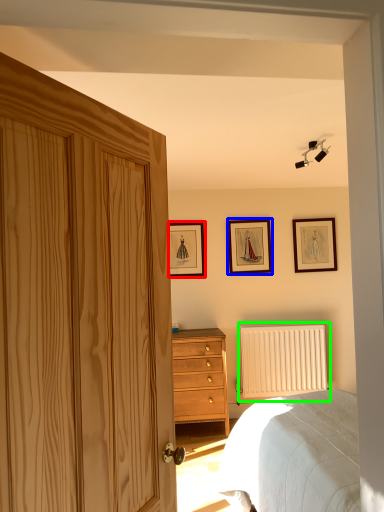
Question: Which is nearer to the picture frame (highlighted by a red box)? picture frame (highlighted by a blue box) or radiator (highlighted by a green box).

Choices:
 (A) picture frame
 (B) radiator

Answer: (A)